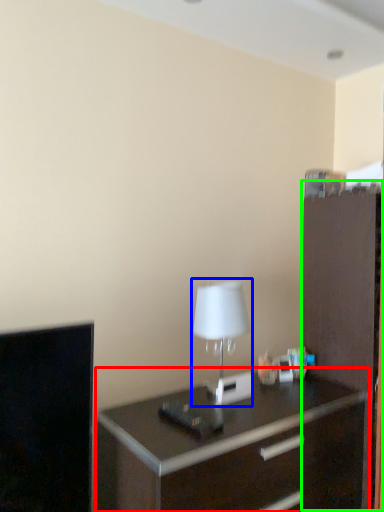
Question: Considering the real-world distances, which object is farthest from chest of drawers (highlighted by a red box)? table lamp (highlighted by a blue box) or file cabinet (highlighted by a green box)?

Choices:
 (A) table lamp
 (B) file cabinet

Answer: (A)